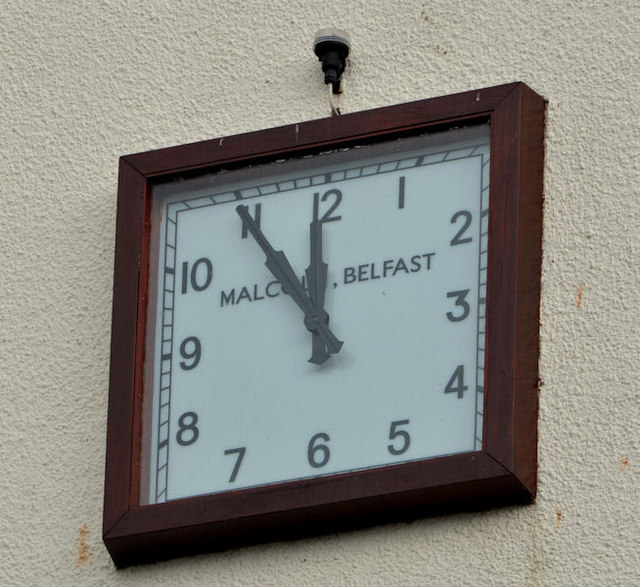
Where is `1 brown framed clock`? The width and height of the screenshot is (640, 587). 1 brown framed clock is located at coordinates (454, 475).